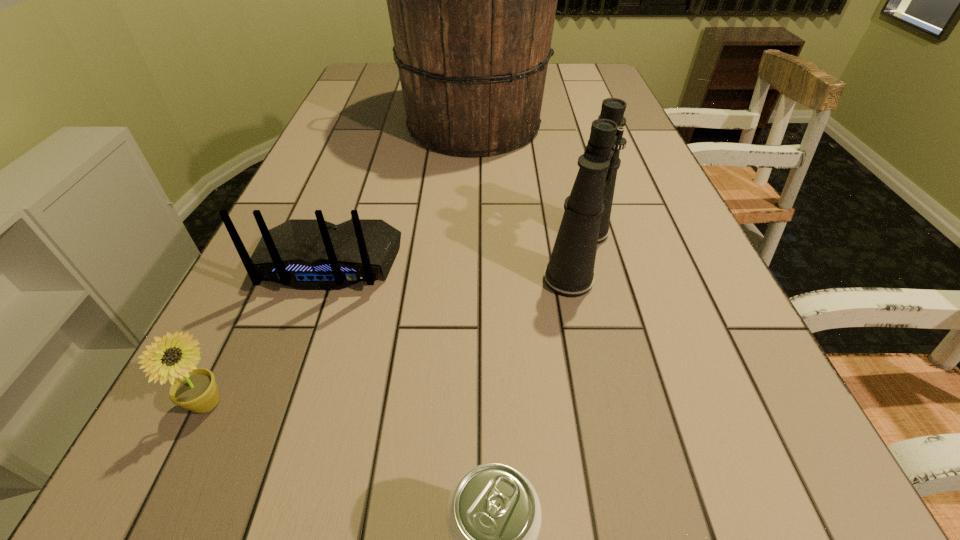
This screenshot has width=960, height=540. I want to click on object that is the second closest to the sunflower, so coord(493,514).

Where is `object that is the second closest one to the router`? Image resolution: width=960 pixels, height=540 pixels. object that is the second closest one to the router is located at coordinates (472, 0).

You are a GUI agent. You are given a task and a screenshot of the screen. Output one action in this format:
    pyautogui.click(x=<x>, y=<y>)
    Task: Click on the vacant region that satisfies the following two spatial constraints: 1. on the front side of the fourth shortest object; 2. on the face of the sunflower
    Image resolution: width=960 pixels, height=540 pixels.
    Given the screenshot: What is the action you would take?
    pyautogui.click(x=612, y=404)

The width and height of the screenshot is (960, 540). In order to click on vacant region that satisfies the following two spatial constraints: 1. on the front side of the tallest object; 2. on the left side of the binoculars in this screenshot , I will do `click(462, 255)`.

This screenshot has height=540, width=960. Find the location of `free space that satisfies the following two spatial constraints: 1. on the front side of the binoculars; 2. on the face of the sunflower`. free space that satisfies the following two spatial constraints: 1. on the front side of the binoculars; 2. on the face of the sunflower is located at coordinates (612, 404).

Image resolution: width=960 pixels, height=540 pixels. In order to click on free space that satisfies the following two spatial constraints: 1. on the back of the router; 2. on the face of the fourth farthest object in this screenshot , I will do `click(279, 404)`.